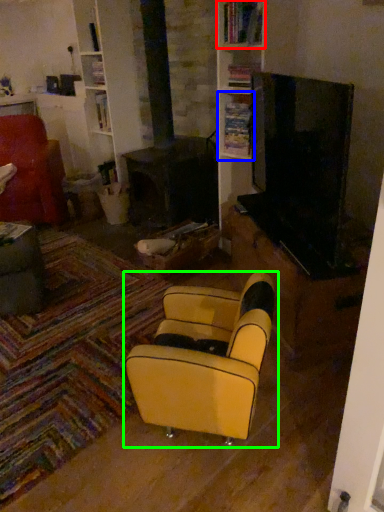
Question: Which is nearer to the shelf (highlighted by a red box)? shelf (highlighted by a blue box) or chair (highlighted by a green box).

Choices:
 (A) shelf
 (B) chair

Answer: (A)